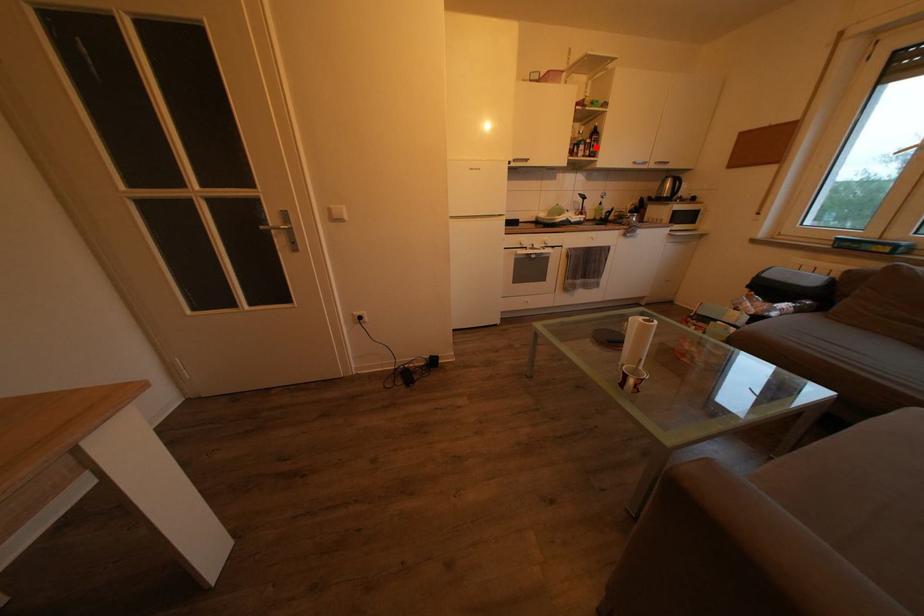
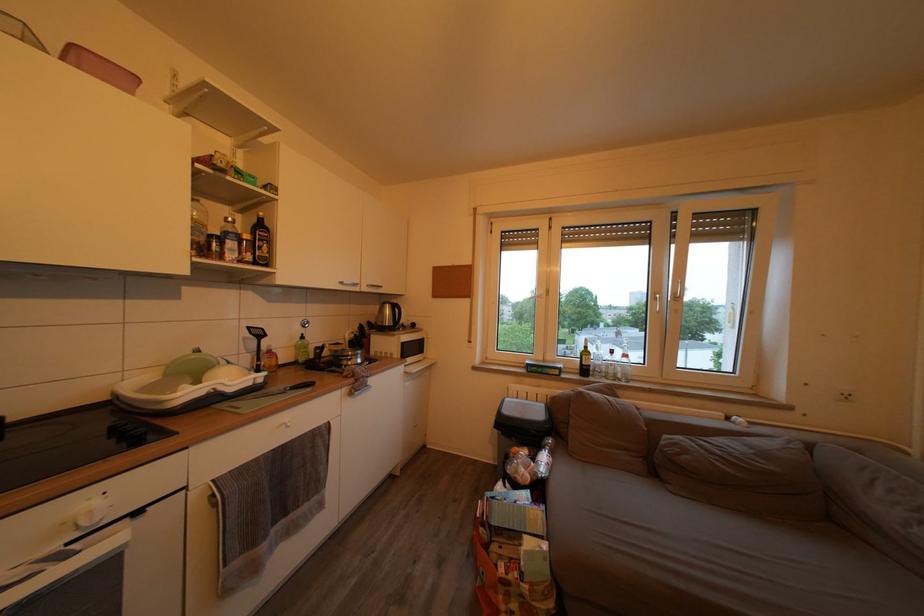
Where in the second image is the point corresponding to the highlighted location from the first image?

(253, 243)